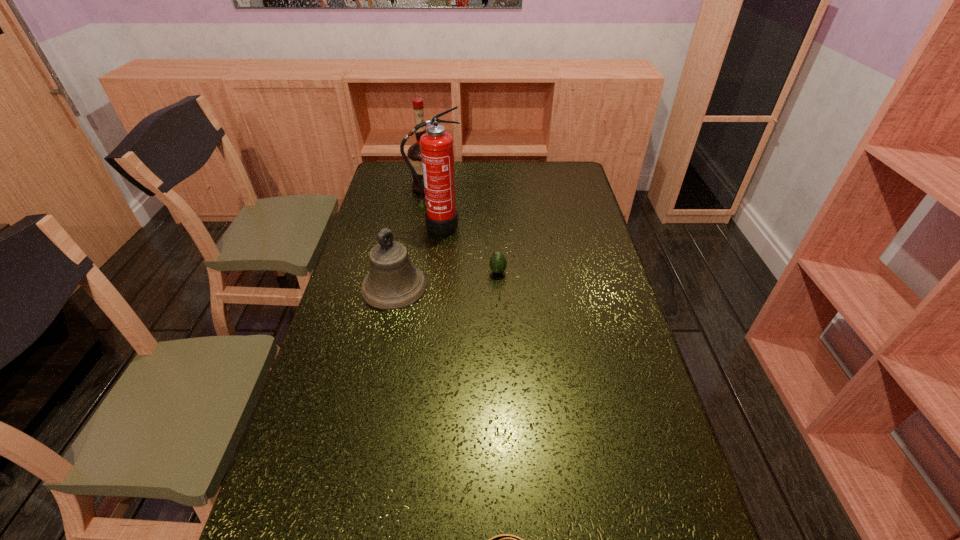
Find the location of a particular element. object at the far edge is located at coordinates 414,152.

The height and width of the screenshot is (540, 960). I want to click on liquor located in the left edge section of the desktop, so click(x=414, y=152).

This screenshot has width=960, height=540. I want to click on bell present at the left edge, so click(x=393, y=282).

Identify the location of object present at the far left corner. pos(414,152).

This screenshot has width=960, height=540. Find the location of `free space at the left edge`. free space at the left edge is located at coordinates (320, 385).

This screenshot has width=960, height=540. What are the coordinates of `free space at the right edge of the desktop` in the screenshot? It's located at (642, 399).

The height and width of the screenshot is (540, 960). I want to click on free space at the far right corner of the desktop, so click(x=559, y=167).

Locate an element on the screen. Image resolution: width=960 pixels, height=540 pixels. free area in between the avocado and the fourth nearest object is located at coordinates pos(467,249).

You are a GUI agent. You are given a task and a screenshot of the screen. Output one action in this format:
    pyautogui.click(x=<x>, y=<y>)
    Task: Click on the free space between the tallest object and the avocado
    
    Given the screenshot: What is the action you would take?
    pyautogui.click(x=467, y=249)

Locate an element on the screen. The image size is (960, 540). the fourth closest object to the avocado is located at coordinates (504, 539).